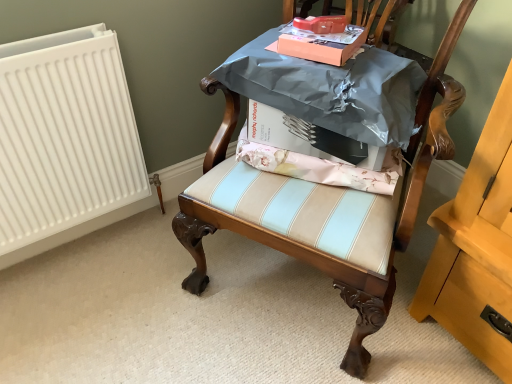
Question: Is matte orange cardboard box at upper center, the first cardboard box in the top-to-bottom sequence, taller than white cardboard box at center, which is the 2th cardboard box from top to bottom?

Choices:
 (A) yes
 (B) no

Answer: (B)

Question: Can you confirm if matte orange cardboard box at upper center, the first cardboard box in the top-to-bottom sequence, is bigger than white cardboard box at center, which ranks as the first cardboard box in bottom-to-top order?

Choices:
 (A) yes
 (B) no

Answer: (B)

Question: Is white cardboard box at center, which ranks as the first cardboard box in bottom-to-top order, surrounded by matte orange cardboard box at upper center, the 2th cardboard box positioned from the bottom?

Choices:
 (A) no
 (B) yes

Answer: (A)

Question: From the image's perspective, is matte orange cardboard box at upper center, the 2th cardboard box positioned from the bottom, below white cardboard box at center, which is the 2th cardboard box from top to bottom?

Choices:
 (A) yes
 (B) no

Answer: (B)

Question: Is matte orange cardboard box at upper center, the first cardboard box in the top-to-bottom sequence, wider than white cardboard box at center, which ranks as the first cardboard box in bottom-to-top order?

Choices:
 (A) no
 (B) yes

Answer: (A)

Question: From a real-world perspective, is matte orange cardboard box at upper center, the 2th cardboard box positioned from the bottom, physically located above or below pink floral fabric at center?

Choices:
 (A) above
 (B) below

Answer: (A)

Question: Looking at their shapes, would you say matte orange cardboard box at upper center, the first cardboard box in the top-to-bottom sequence, is wider or thinner than pink floral fabric at center?

Choices:
 (A) thin
 (B) wide

Answer: (A)

Question: Is matte orange cardboard box at upper center, the 2th cardboard box positioned from the bottom, inside or outside of pink floral fabric at center?

Choices:
 (A) inside
 (B) outside

Answer: (B)

Question: Is matte orange cardboard box at upper center, the 2th cardboard box positioned from the bottom, to the left or to the right of pink floral fabric at center in the image?

Choices:
 (A) right
 (B) left

Answer: (B)

Question: Considering the positions of white cardboard box at center, which is the 2th cardboard box from top to bottom, and wooden chair at center in the image, is white cardboard box at center, which is the 2th cardboard box from top to bottom, taller or shorter than wooden chair at center?

Choices:
 (A) short
 (B) tall

Answer: (A)

Question: From a real-world perspective, relative to wooden chair at center, is white cardboard box at center, which ranks as the first cardboard box in bottom-to-top order, vertically above or below?

Choices:
 (A) below
 (B) above

Answer: (B)

Question: Would you say white cardboard box at center, which is the 2th cardboard box from top to bottom, is to the left or to the right of wooden chair at center in the picture?

Choices:
 (A) right
 (B) left

Answer: (A)

Question: In terms of size, does white cardboard box at center, which ranks as the first cardboard box in bottom-to-top order, appear bigger or smaller than wooden chair at center?

Choices:
 (A) small
 (B) big

Answer: (A)

Question: Would you say white cardboard box at center, which is the 2th cardboard box from top to bottom, is to the left or to the right of matte orange cardboard box at upper center, the 2th cardboard box positioned from the bottom, in the picture?

Choices:
 (A) right
 (B) left

Answer: (A)

Question: Considering the positions of point (285, 140) and point (309, 34), is point (285, 140) closer or farther from the camera than point (309, 34)?

Choices:
 (A) farther
 (B) closer

Answer: (A)